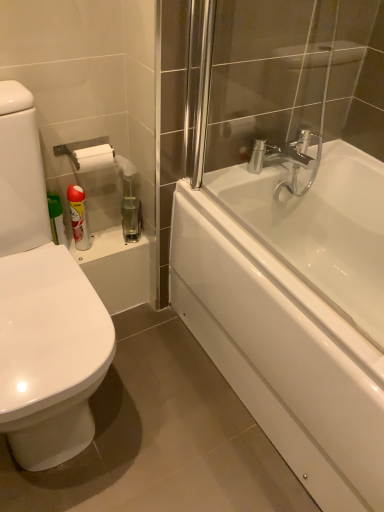
Identify the location of vacant region in front of translucent plastic spray bottle at upper left. The width and height of the screenshot is (384, 512). (118, 248).